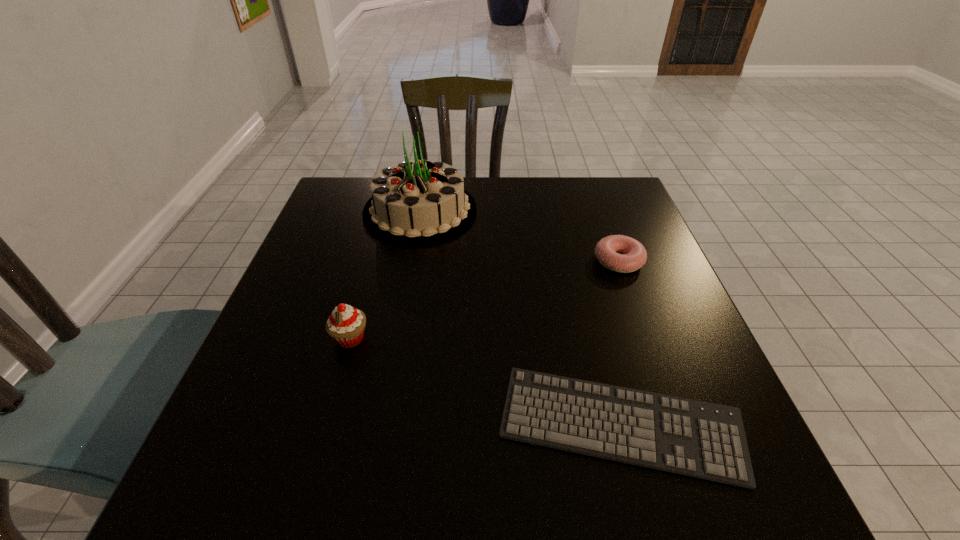
This screenshot has height=540, width=960. I want to click on unoccupied position between the third shortest object and the tallest object, so click(385, 275).

At what (x,y) coordinates should I click in order to perform the action: click on unoccupied area between the doughnut and the third farthest object. Please return your answer as a coordinate pair (x, y). Looking at the image, I should click on (485, 299).

Locate an element on the screen. This screenshot has height=540, width=960. unoccupied position between the nearest object and the third tallest object is located at coordinates (619, 343).

Identify the location of object that is the second nearest to the tallest object. The width and height of the screenshot is (960, 540). click(634, 255).

Where is `object that is the closest to the birthday cake`? object that is the closest to the birthday cake is located at coordinates (346, 324).

I want to click on vacant position in the image that satisfies the following two spatial constraints: 1. on the back side of the third farthest object; 2. on the right side of the birthday cake, so click(386, 211).

This screenshot has width=960, height=540. In order to click on vacant space that satisfies the following two spatial constraints: 1. on the front side of the third tallest object; 2. on the left side of the tallest object in this screenshot , I will do `click(411, 260)`.

This screenshot has height=540, width=960. In order to click on vacant area that satisfies the following two spatial constraints: 1. on the front side of the cupcake; 2. on the right side of the nearest object in this screenshot , I will do `click(325, 425)`.

This screenshot has width=960, height=540. Find the location of `vacant space that satisfies the following two spatial constraints: 1. on the back side of the second shortest object; 2. on the right side of the third farthest object`. vacant space that satisfies the following two spatial constraints: 1. on the back side of the second shortest object; 2. on the right side of the third farthest object is located at coordinates (372, 260).